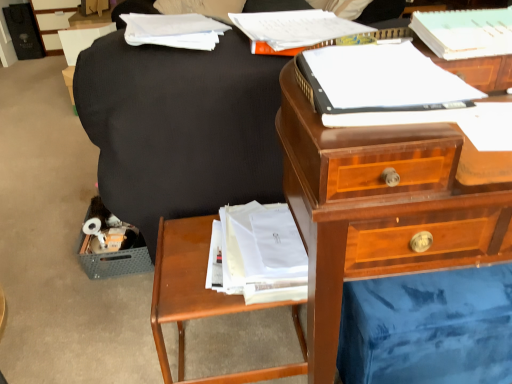
Image resolution: width=512 pixels, height=384 pixels. I want to click on blank space situated above wooden nightstand at lower left (from a real-world perspective), so click(189, 257).